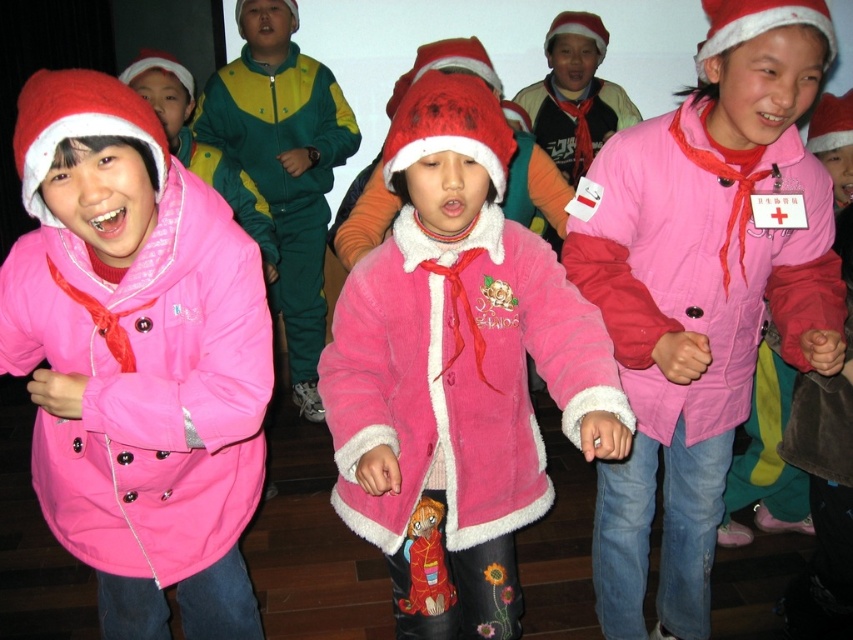
You are a photographer trying to capture a photo of the two points in the image. The first point is at coordinate point (125, 372) and the second is at point (231, 60). Which point is closer to the camera?

Point (125, 372) is in front of point (231, 60), so it is closer to the camera.